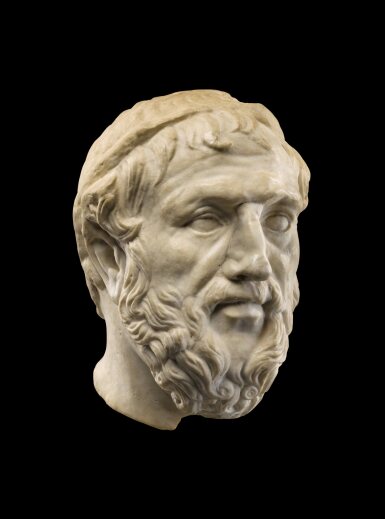
At what (x,y) coordinates should I click in order to perform the action: click on sculpture. Please return your answer as a coordinate pair (x, y). Image resolution: width=385 pixels, height=519 pixels. Looking at the image, I should click on (254, 163).